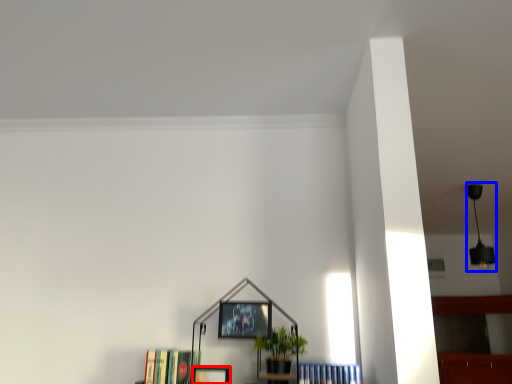
Question: Which object is closer to the camera taking this photo, picture frame (highlighted by a red box) or lamp (highlighted by a blue box)?

Choices:
 (A) picture frame
 (B) lamp

Answer: (A)